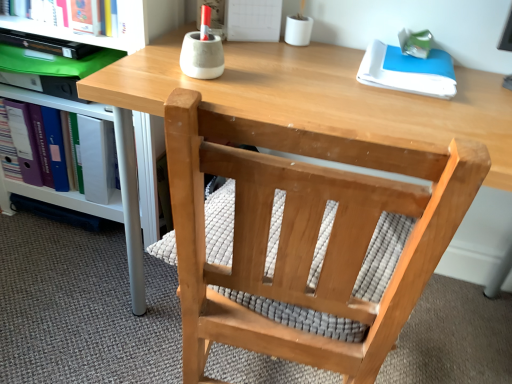
The width and height of the screenshot is (512, 384). Find the location of `empty space that is ontop of white paper at upper right (from a real-world perspective)`. empty space that is ontop of white paper at upper right (from a real-world perspective) is located at coordinates (412, 59).